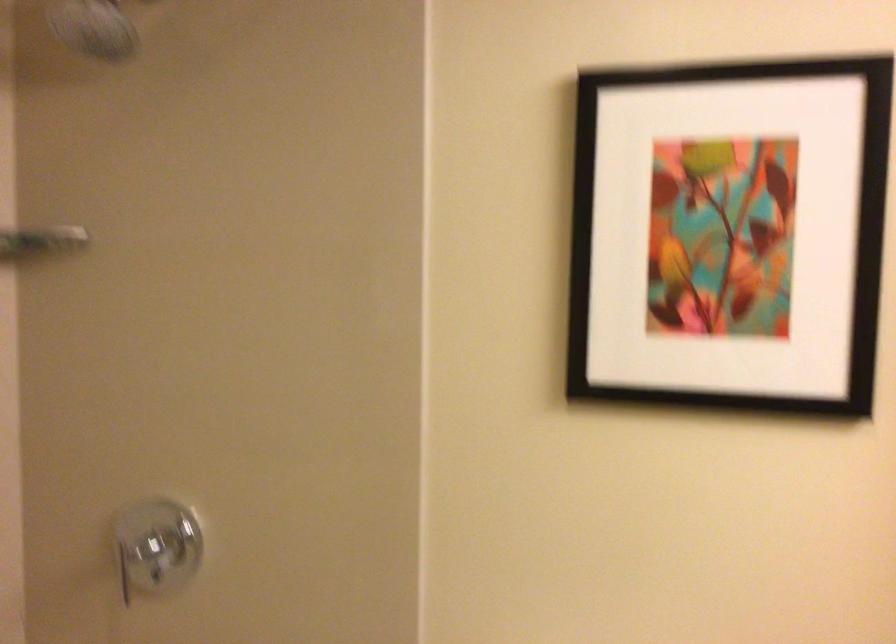
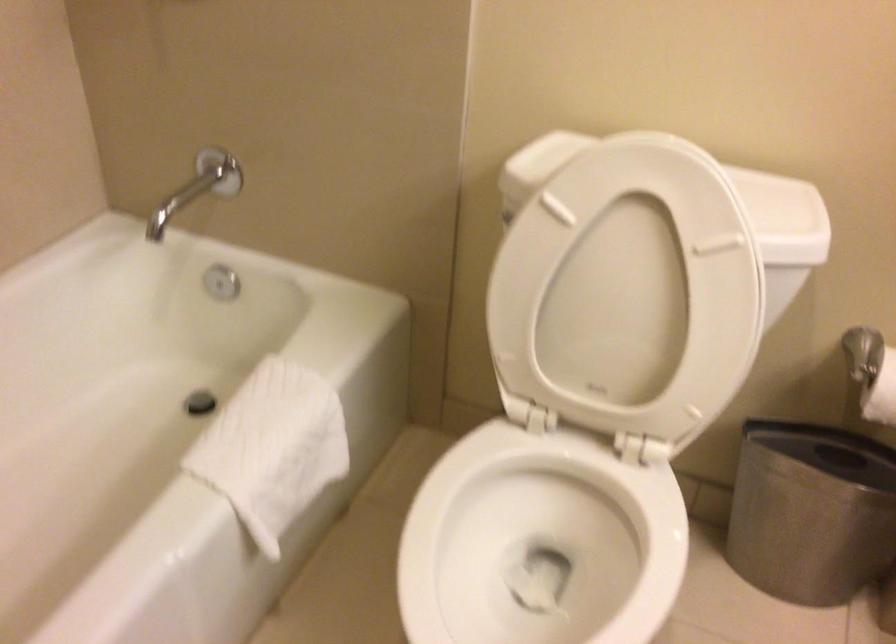
Question: The first image is from the beginning of the video and the second image is from the end. How did the camera likely rotate when shooting the video?

Choices:
 (A) Left
 (B) Right
 (C) Up
 (D) Down

Answer: (D)